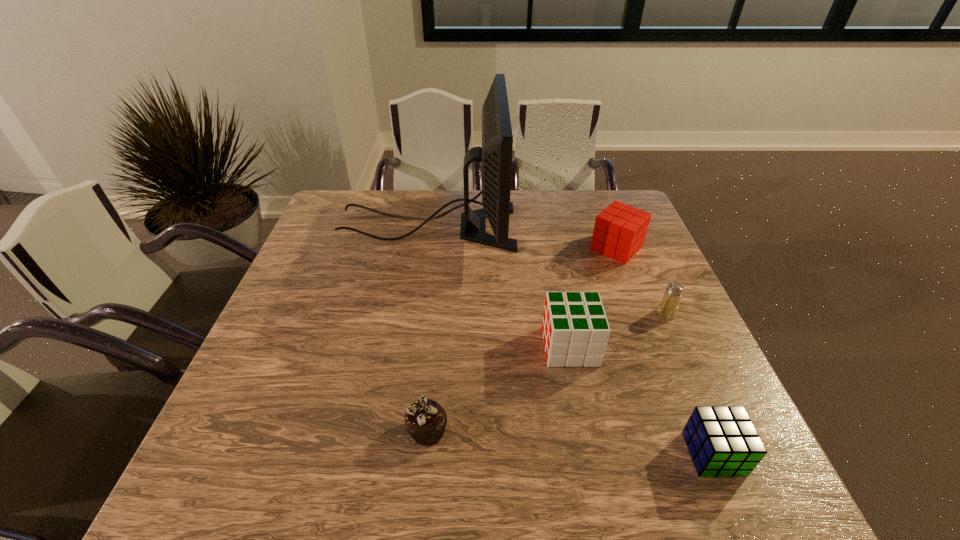
Find the location of a particular element. This screenshot has height=540, width=960. vacant area between the tallest object and the farthest cube is located at coordinates (522, 238).

Locate an element on the screen. Image resolution: width=960 pixels, height=540 pixels. free space between the shortest cube and the third object from left to right is located at coordinates (641, 400).

Where is `blank region between the nearest cube and the farthest cube`? Image resolution: width=960 pixels, height=540 pixels. blank region between the nearest cube and the farthest cube is located at coordinates (664, 351).

This screenshot has width=960, height=540. Find the location of `vacant space that's between the farthest cube and the computer monitor`. vacant space that's between the farthest cube and the computer monitor is located at coordinates (522, 238).

This screenshot has width=960, height=540. What are the coordinates of `free area in between the cupcake and the nearest cube` in the screenshot? It's located at (570, 442).

Locate an element on the screen. The height and width of the screenshot is (540, 960). free space between the fourth nearest object and the second nearest cube is located at coordinates (618, 330).

At what (x,y) coordinates should I click in order to perform the action: click on vacant space that is in between the farthest cube and the tallest object. Please return your answer as a coordinate pair (x, y). Image resolution: width=960 pixels, height=540 pixels. Looking at the image, I should click on (522, 238).

What are the coordinates of `the second closest object to the farthest cube` in the screenshot? It's located at (495, 154).

The height and width of the screenshot is (540, 960). In order to click on object identified as the third closest to the saltshaker in this screenshot , I will do `click(722, 441)`.

The image size is (960, 540). Find the location of `cube that can be found as the second closest to the fourth object from right to left`. cube that can be found as the second closest to the fourth object from right to left is located at coordinates (620, 230).